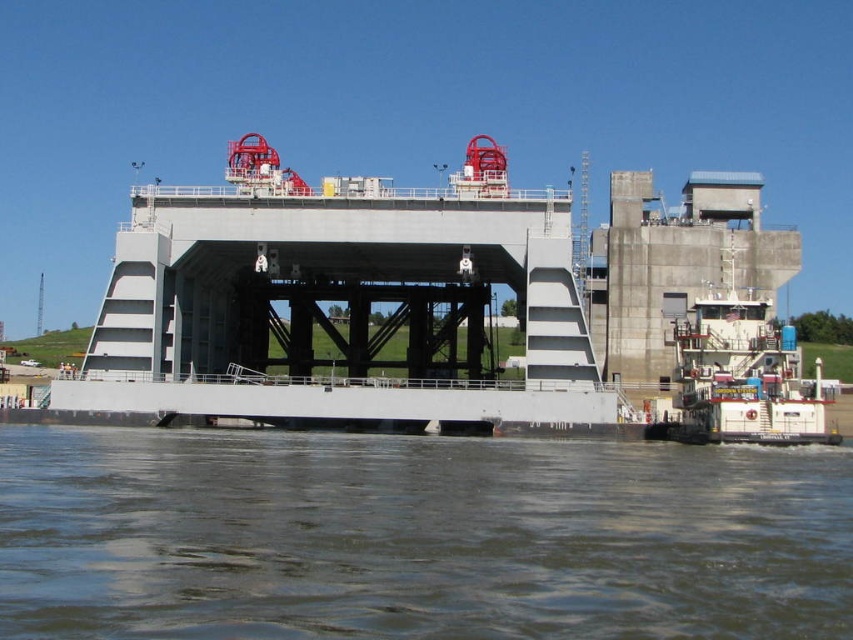
Is gray metallic bridge at center below white matte tugboat at lower right?

Incorrect, gray metallic bridge at center is not positioned below white matte tugboat at lower right.

Can you confirm if gray metallic bridge at center is positioned to the right of white matte tugboat at lower right?

Incorrect, gray metallic bridge at center is not on the right side of white matte tugboat at lower right.

Does point (213, 394) come closer to viewer compared to point (706, 346)?

That is False.

Find the location of `gray metallic bridge at center`. gray metallic bridge at center is located at coordinates (340, 300).

Does point (271, 490) lie in front of point (198, 365)?

That is True.

The height and width of the screenshot is (640, 853). What do you see at coordinates (416, 538) in the screenshot?
I see `brown murky water at lower center` at bounding box center [416, 538].

Between point (717, 540) and point (306, 333), which one is positioned behind?

Point (306, 333)

In order to click on brown murky water at lower center in this screenshot , I will do `click(416, 538)`.

Between brown murky water at lower center and white matte tugboat at lower right, which one has less height?

brown murky water at lower center

Is brown murky water at lower center positioned behind white matte tugboat at lower right?

No, it is not.

Is point (808, 557) positioned in front of point (708, 396)?

That is True.

Where is `brown murky water at lower center`? brown murky water at lower center is located at coordinates (416, 538).